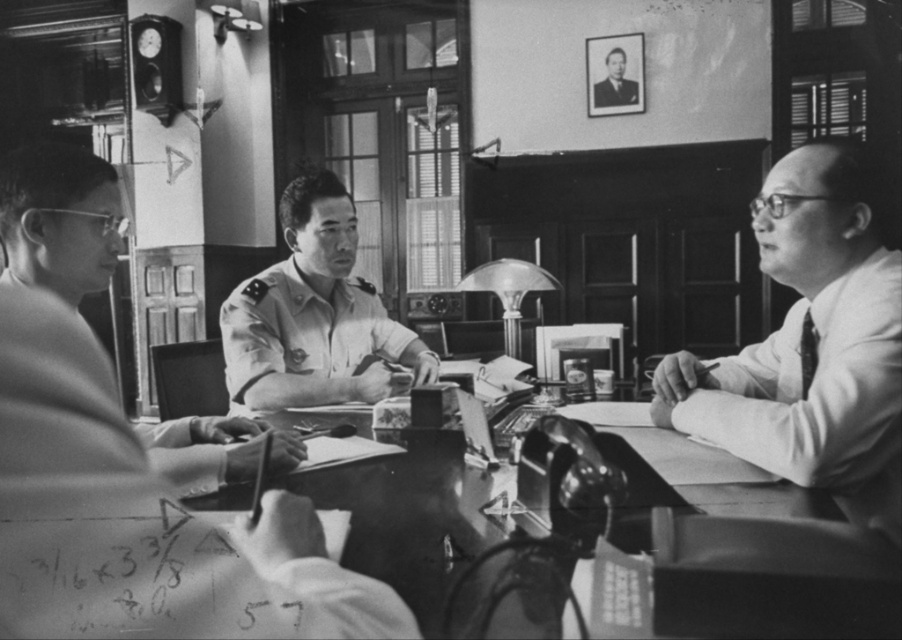
Question: Which point appears farthest from the camera in this image?

Choices:
 (A) (251, 621)
 (B) (419, 353)
 (C) (606, 74)
 (D) (624, 545)

Answer: (C)

Question: Which of the following is the closest to the observer?

Choices:
 (A) (116, 188)
 (B) (618, 64)
 (C) (433, 352)

Answer: (A)

Question: Can you confirm if uniformed officer at center is wider than uniform at center?

Choices:
 (A) yes
 (B) no

Answer: (A)

Question: Which is nearer to the smooth white shirt at right?

Choices:
 (A) smooth wooden table at center
 (B) uniformed officer at center
 (C) smooth black suit at upper right

Answer: (A)

Question: Is uniformed officer at center to the left of smooth black suit at upper right from the viewer's perspective?

Choices:
 (A) no
 (B) yes

Answer: (B)

Question: Where is smooth white shirt at right located in relation to smooth wooden table at center in the image?

Choices:
 (A) below
 (B) above

Answer: (B)